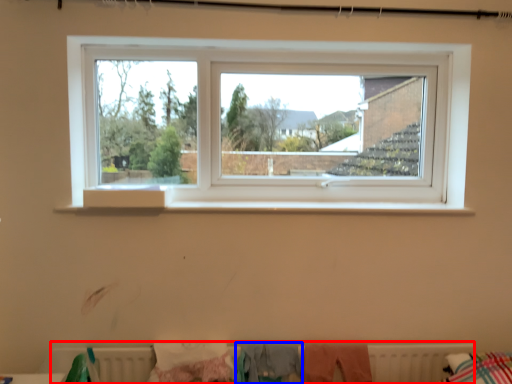
Question: Which of the following is the closest to the observer, radiator (highlighted by a red box) or clothing (highlighted by a blue box)?

Choices:
 (A) radiator
 (B) clothing

Answer: (B)